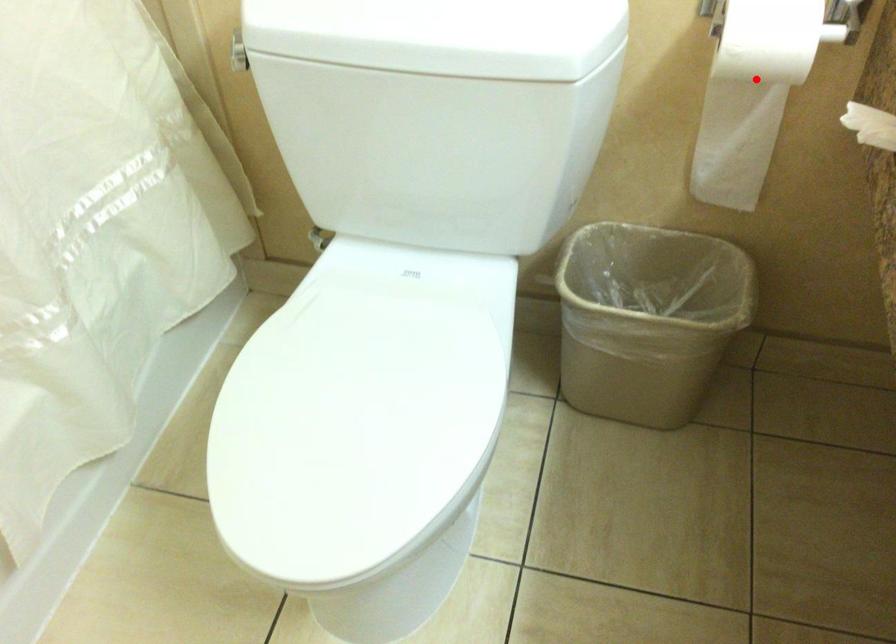
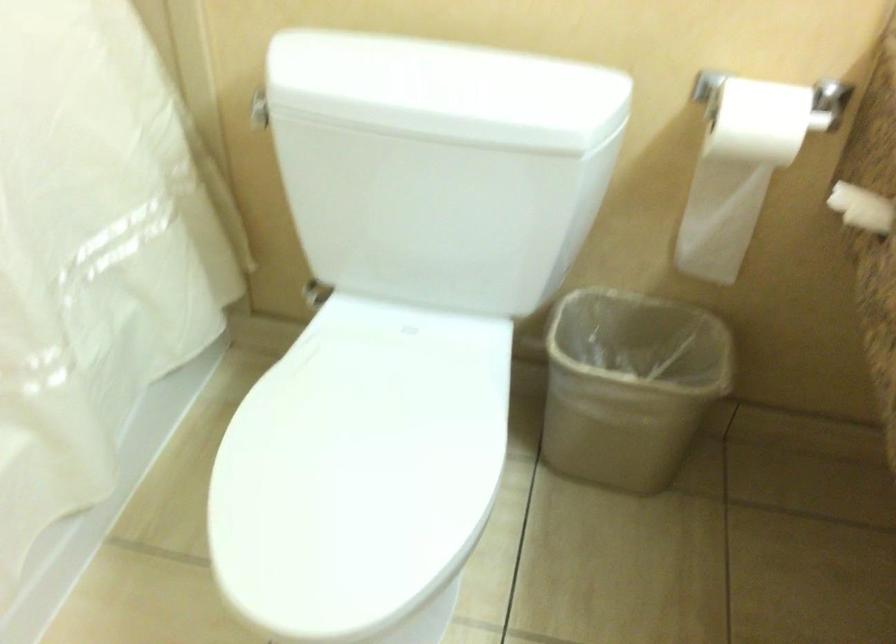
The point at the highlighted location is marked in the first image. Where is the corresponding point in the second image?

(744, 162)